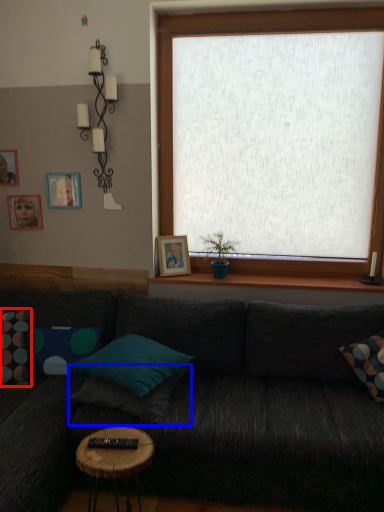
Question: Which of the following is the farthest to the observer, pillow (highlighted by a red box) or pillow (highlighted by a blue box)?

Choices:
 (A) pillow
 (B) pillow

Answer: (A)